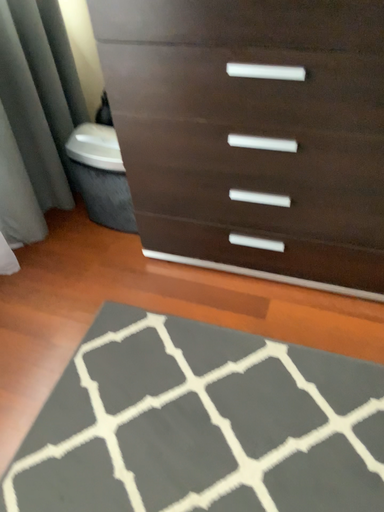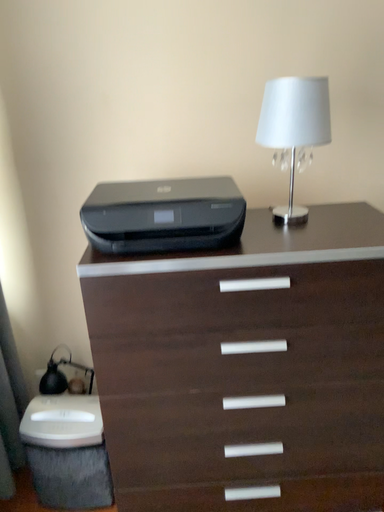
Question: How did the camera likely rotate when shooting the video?

Choices:
 (A) rotated left
 (B) rotated right

Answer: (B)